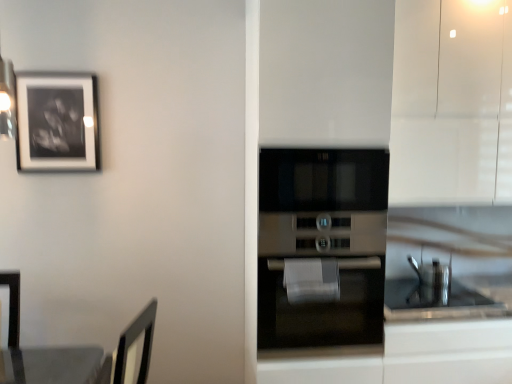
Locate an element on the screen. black matte picture frame at upper left is located at coordinates (57, 122).

Find the location of a particular element. white glossy cabinet at upper right is located at coordinates (452, 103).

Is black matte picture frame at upper left in front of or behind white glossy cabinet at upper right in the image?

black matte picture frame at upper left is behind white glossy cabinet at upper right.

From the image's perspective, which is above, black matte picture frame at upper left or white glossy cabinet at upper right?

white glossy cabinet at upper right.

Where is `cabinetry on the right of black matte picture frame at upper left`? This screenshot has height=384, width=512. cabinetry on the right of black matte picture frame at upper left is located at coordinates (452, 103).

Does point (321, 185) appear closer or farther from the camera than point (436, 45)?

Point (321, 185) is positioned closer to the camera compared to point (436, 45).

Is stainless steel oven at center facing away from white glossy cabinet at upper right?

No, stainless steel oven at center is not facing the opposite direction of white glossy cabinet at upper right.

Is stainless steel oven at center placed right next to white glossy cabinet at upper right?

No, stainless steel oven at center is not in contact with white glossy cabinet at upper right.

This screenshot has height=384, width=512. Find the location of `cabinetry above the stainless steel oven at center (from a real-world perspective)`. cabinetry above the stainless steel oven at center (from a real-world perspective) is located at coordinates (452, 103).

Which of these two, white glossy cabinet at upper right or black matte picture frame at upper left, stands shorter?

black matte picture frame at upper left.

Relative to black matte picture frame at upper left, is white glossy cabinet at upper right in front or behind?

white glossy cabinet at upper right is in front of black matte picture frame at upper left.

Is white glossy cabinet at upper right to the left or to the right of black matte picture frame at upper left in the image?

In the image, white glossy cabinet at upper right appears on the right side of black matte picture frame at upper left.

Would you say white glossy cabinet at upper right is inside or outside black matte picture frame at upper left?

white glossy cabinet at upper right is outside black matte picture frame at upper left.

Could you tell me if stainless steel oven at center is turned towards black matte picture frame at upper left?

No, stainless steel oven at center is not oriented towards black matte picture frame at upper left.

Consider the image. Considering the relative sizes of stainless steel oven at center and black matte picture frame at upper left in the image provided, is stainless steel oven at center bigger than black matte picture frame at upper left?

Yes.

Is stainless steel oven at center directly adjacent to black matte picture frame at upper left?

No.

This screenshot has width=512, height=384. In order to click on oven in front of the black matte picture frame at upper left in this screenshot , I will do `click(321, 249)`.

Can you confirm if black matte picture frame at upper left is taller than stainless steel oven at center?

No, black matte picture frame at upper left is not taller than stainless steel oven at center.

Would you say black matte picture frame at upper left is to the left or to the right of stainless steel oven at center in the picture?

From the image, it's evident that black matte picture frame at upper left is to the left of stainless steel oven at center.

At what (x,y) coordinates should I click in order to perform the action: click on picture frame above the stainless steel oven at center (from a real-world perspective). Please return your answer as a coordinate pair (x, y). Image resolution: width=512 pixels, height=384 pixels. Looking at the image, I should click on (57, 122).

Can stainless steel oven at center be found inside white glossy cabinet at upper right?

That's incorrect, stainless steel oven at center is not inside white glossy cabinet at upper right.

The image size is (512, 384). What are the coordinates of `oven in front of the white glossy cabinet at upper right` in the screenshot? It's located at (321, 249).

Find the location of a particular element. The width and height of the screenshot is (512, 384). cabinetry on the right of black matte picture frame at upper left is located at coordinates (452, 103).

Where is `cabinetry that appears above the stainless steel oven at center (from the image's perspective)`? The width and height of the screenshot is (512, 384). cabinetry that appears above the stainless steel oven at center (from the image's perspective) is located at coordinates (452, 103).

Estimate the real-world distances between objects in this image. Which object is further from black matte picture frame at upper left, stainless steel oven at center or white glossy cabinet at upper right?

white glossy cabinet at upper right is positioned further to the anchor black matte picture frame at upper left.

Which object lies nearer to the anchor point stainless steel oven at center, white glossy cabinet at upper right or black matte picture frame at upper left?

white glossy cabinet at upper right lies closer to stainless steel oven at center than the other object.

Looking at the image, which one is located closer to black matte picture frame at upper left, white glossy cabinet at upper right or stainless steel oven at center?

stainless steel oven at center lies closer to black matte picture frame at upper left than the other object.

When comparing their distances from stainless steel oven at center, does black matte picture frame at upper left or white glossy cabinet at upper right seem closer?

Based on the image, white glossy cabinet at upper right appears to be nearer to stainless steel oven at center.

When comparing their distances from white glossy cabinet at upper right, does black matte picture frame at upper left or stainless steel oven at center seem further?

black matte picture frame at upper left is positioned further to the anchor white glossy cabinet at upper right.

Considering their positions, is stainless steel oven at center positioned closer to white glossy cabinet at upper right than black matte picture frame at upper left?

stainless steel oven at center lies closer to white glossy cabinet at upper right than the other object.

In order to click on oven between black matte picture frame at upper left and white glossy cabinet at upper right in this screenshot , I will do `click(321, 249)`.